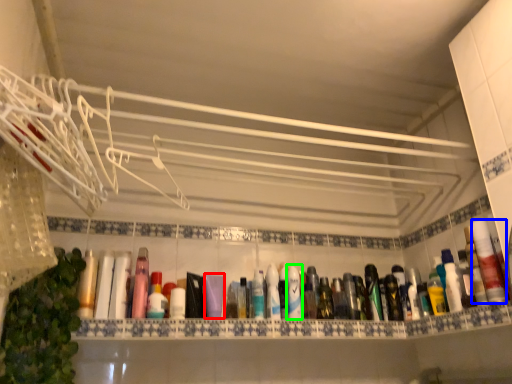
Question: Based on their relative distances, which object is nearer to mouthwash (highlighted by a red box)? Choose from mouthwash (highlighted by a blue box) and mouthwash (highlighted by a green box).

Choices:
 (A) mouthwash
 (B) mouthwash

Answer: (B)